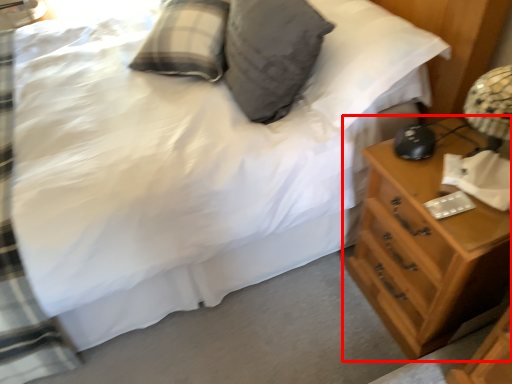
Question: From the image's perspective, what is the correct spatial relationship of chest of drawers (annotated by the red box) in relation to pillow?

Choices:
 (A) above
 (B) below

Answer: (B)